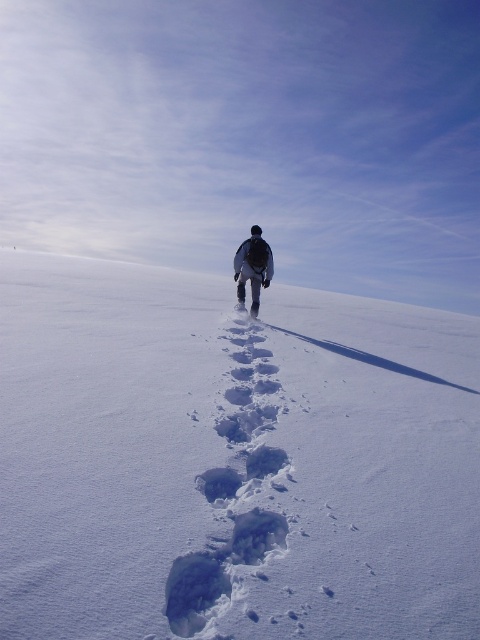
You are standing at the origin point in this winter scene and want to reach the white powdery snow at center. What are the coordinates you need to move to?

You need to move to the coordinates point at [231,460] to reach the white powdery snow at center.

Based on the photo, you are a snowplow operator who needs to clear a path through the white powdery snow at center. The snowplow is 1.9 meters wide. Can you safely navigate around the dark gray fabric jacket at center without hitting it?

The distance between the white powdery snow at center and the dark gray fabric jacket at center is 1.87 meters. Since the snowplow is 1.9 meters wide, it is slightly wider than the available space. Therefore, you cannot safely navigate around the dark gray fabric jacket at center without risking a collision.

You are standing at the point marked as point (231, 460) in the winter landscape image. What is the surface you are currently standing on?

The point (231, 460) is on white powdery snow at center, so you are standing on white powdery snow at center.